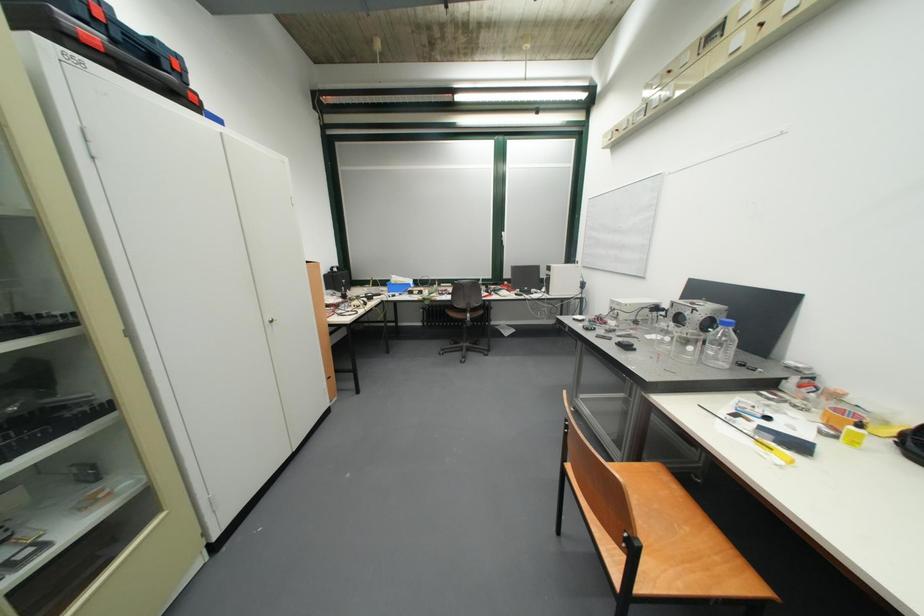
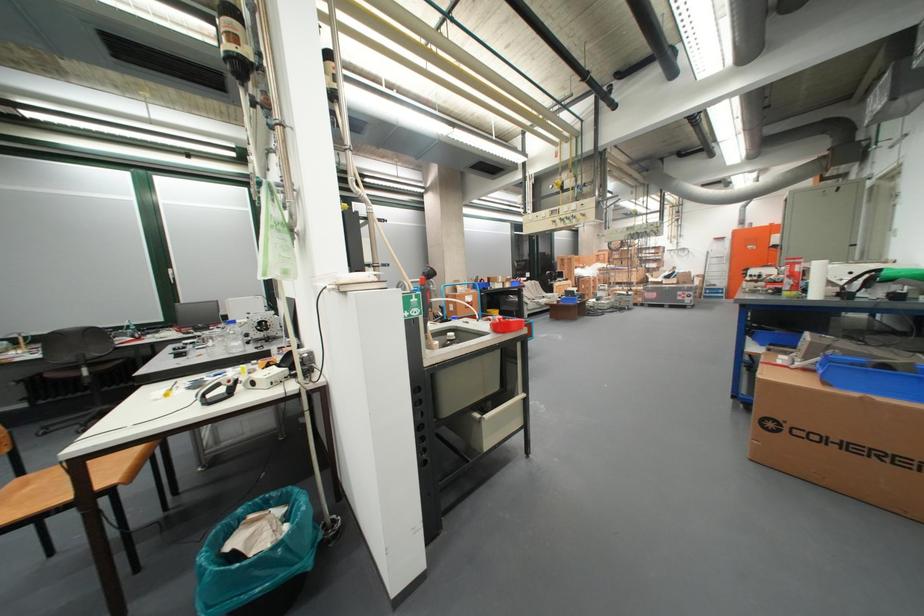
The point at (473,306) is marked in the first image. Where is the corresponding point in the second image?

(79, 360)